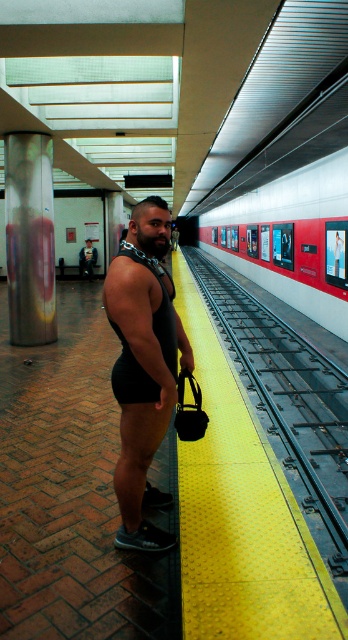
You are a photographer standing on the subway platform. You want to take a photo of the black matte singlet at center and the smooth glossy train at center such that both are in focus. Given that your camera has a depth of field range of 8 meters, will both objects be in focus?

The black matte singlet at center is 8.85 meters away from the smooth glossy train at center. Since the distance between them exceeds the camera depth of field range of 8 meters, the two objects cannot both be in focus at the same time.